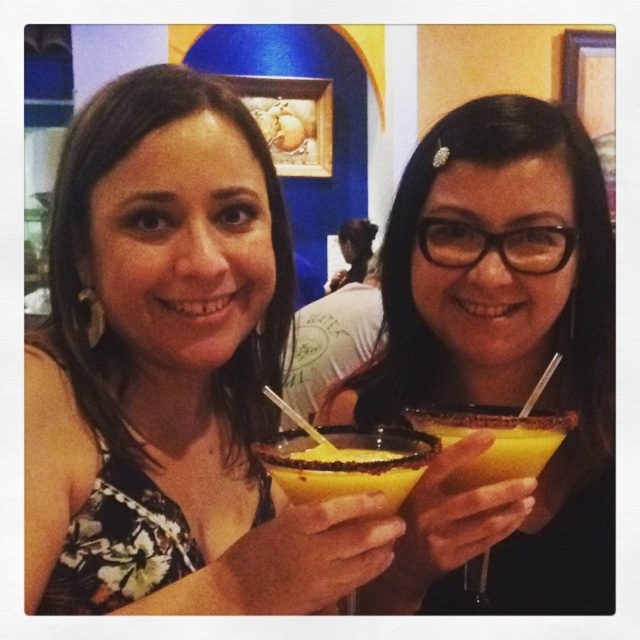
You are at a party and want to place a small decoration exactly at the point marked as point (172, 369). Which object should you place it on?

The point (172, 369) is on the matte black cocktail glass at center, so you should place the decoration on the matte black cocktail glass at center.

You are a bartender trying to clean up after a party. You notice the matte black cocktail glass at center and the yellow liquid at center. Which object is directly above the other?

The matte black cocktail glass at center is positioned over yellow liquid at center, so the glass is directly above the liquid.